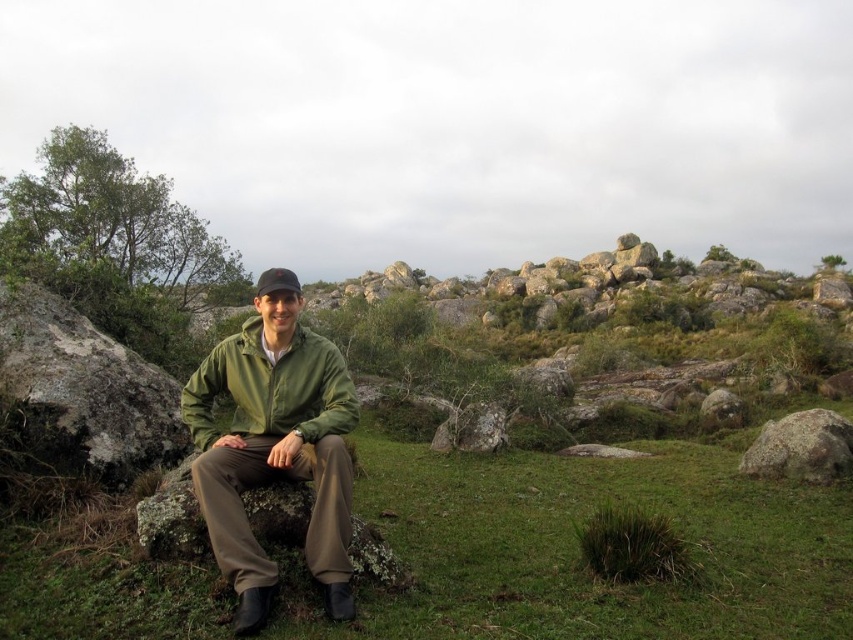
Measure the distance between green grass at center and black fabric cap at center.

8.42 meters

Which is in front, point (798, 556) or point (294, 275)?

Point (798, 556)

You are a GUI agent. You are given a task and a screenshot of the screen. Output one action in this format:
    pyautogui.click(x=<x>, y=<y>)
    Task: Click on the green grass at center
    This screenshot has height=640, width=853.
    Given the screenshot: What is the action you would take?
    pos(578,552)

Is green matte jacket at center bigger than smooth gray rock at center-right?

Indeed, green matte jacket at center has a larger size compared to smooth gray rock at center-right.

Does point (209, 513) lie in front of point (738, 419)?

Yes, point (209, 513) is closer to viewer.

What do you see at coordinates (274, 451) in the screenshot? This screenshot has height=640, width=853. I see `green matte jacket at center` at bounding box center [274, 451].

You are a GUI agent. You are given a task and a screenshot of the screen. Output one action in this format:
    pyautogui.click(x=<x>, y=<y>)
    Task: Click on the green matte jacket at center
    
    Given the screenshot: What is the action you would take?
    click(274, 451)

Who is positioned more to the right, rusty rock at right or black fabric cap at center?

rusty rock at right

Does rusty rock at right have a greater width compared to black fabric cap at center?

No, rusty rock at right is not wider than black fabric cap at center.

Is point (817, 460) in front of point (282, 288)?

That is False.

Identify the location of rusty rock at right. The width and height of the screenshot is (853, 640). (801, 445).